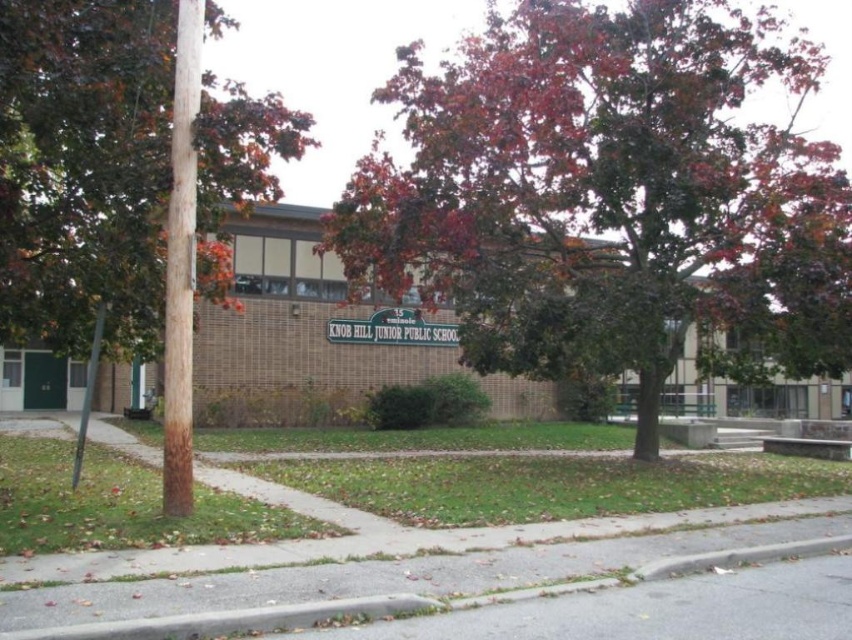
Can you confirm if brown textured pole at left is shorter than brown rough wooden pole at left?

Incorrect, brown textured pole at left's height does not fall short of brown rough wooden pole at left's.

In the scene shown: Is brown textured pole at left smaller than brown rough wooden pole at left?

Incorrect, brown textured pole at left is not smaller in size than brown rough wooden pole at left.

This screenshot has height=640, width=852. Identify the location of brown textured pole at left. (116, 170).

Is point (187, 134) positioned in front of point (433, 337)?

Yes, it is.

What do you see at coordinates (181, 264) in the screenshot?
I see `brown rough wooden pole at left` at bounding box center [181, 264].

This screenshot has height=640, width=852. I want to click on brown rough wooden pole at left, so click(x=181, y=264).

Based on the photo, between brown textured pole at left and metallic pole at left, which one has more height?

Standing taller between the two is brown textured pole at left.

Consider the image. Can you confirm if brown textured pole at left is positioned to the left of metallic pole at left?

No, brown textured pole at left is not to the left of metallic pole at left.

Is point (101, 93) behind point (78, 445)?

No, it is in front of (78, 445).

Locate an element on the screen. brown textured pole at left is located at coordinates (116, 170).